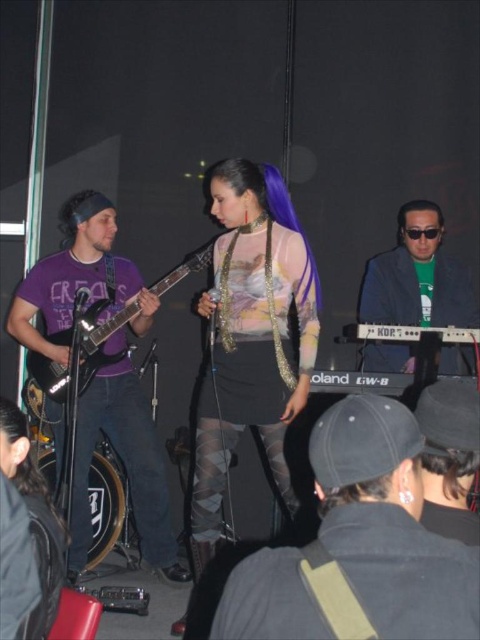
Question: Which is farther from the black fabric cap at lower right?

Choices:
 (A) dark brown silky hair at center
 (B) translucent sheer dress at center
 (C) matte purple shirt at left
 (D) black leather jacket at lower center

Answer: (C)

Question: Which of the following is the closest to the observer?

Choices:
 (A) translucent sheer dress at center
 (B) purple silky hair at center
 (C) black silky hair at upper right
 (D) matte black electric guitar at left

Answer: (A)

Question: Is green matte keyboard at center positioned at the back of dark brown silky hair at center?

Choices:
 (A) no
 (B) yes

Answer: (B)

Question: Considering the relative positions of black fabric cap at lower right and matte black electric guitar at left in the image provided, where is black fabric cap at lower right located with respect to matte black electric guitar at left?

Choices:
 (A) above
 (B) below

Answer: (B)

Question: Which point is farther to the camera?

Choices:
 (A) (214, 173)
 (B) (242, 420)
 (C) (385, 289)
 (D) (455, 461)

Answer: (C)

Question: Does black leather jacket at lower center have a smaller size compared to black fabric cap at lower right?

Choices:
 (A) no
 (B) yes

Answer: (A)